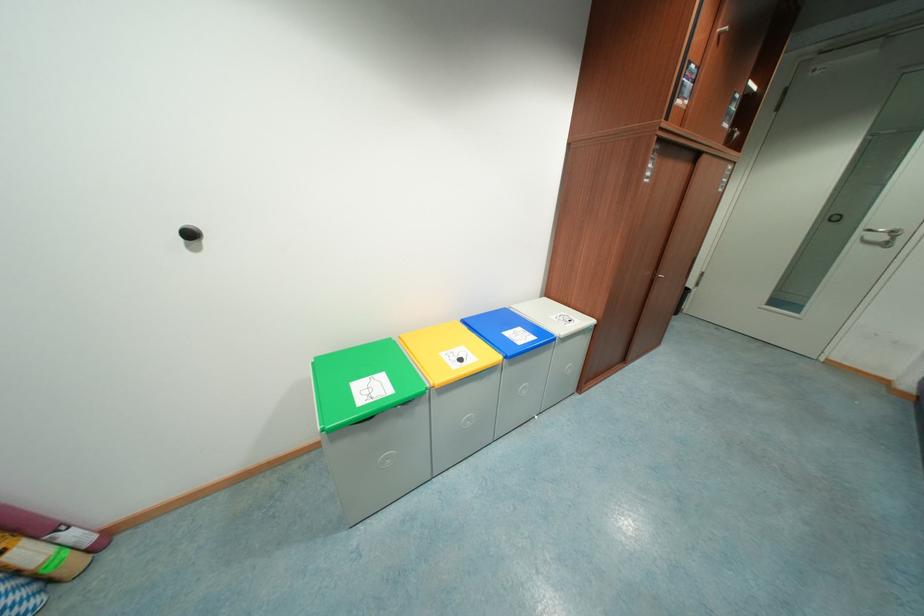
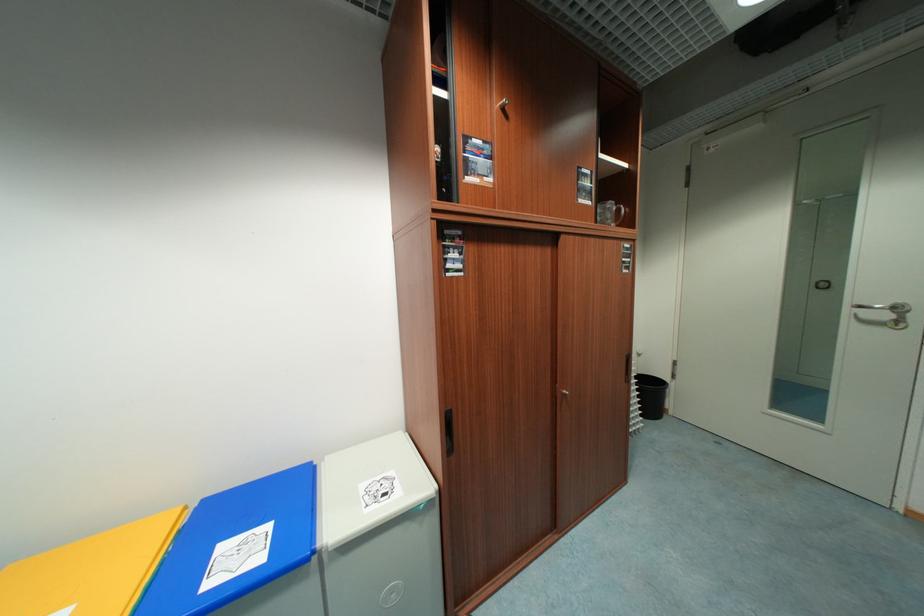
In the second image, find the point that corresponds to (x=558, y=318) in the first image.

(369, 488)